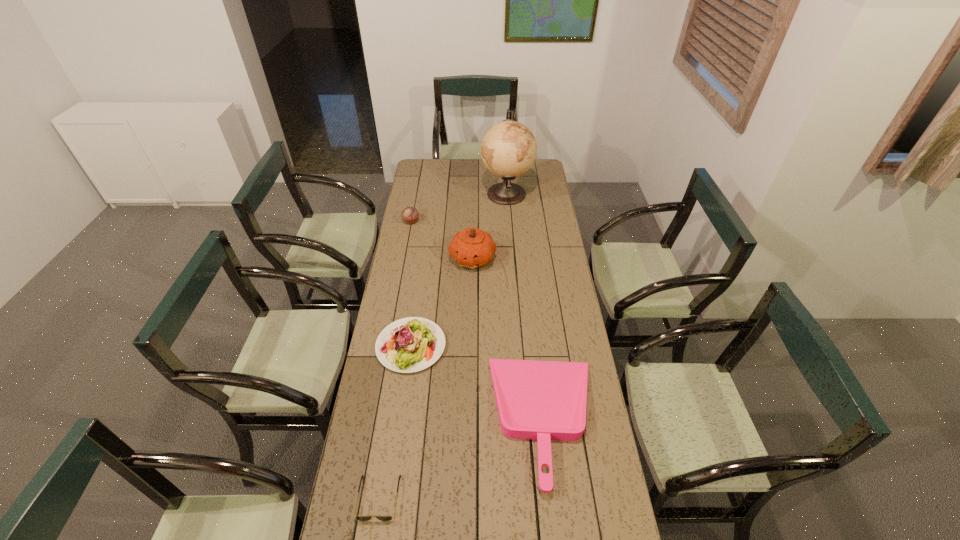
Identify the location of vacant region between the pumpkin and the dustpan. The height and width of the screenshot is (540, 960). (509, 339).

You are a GUI agent. You are given a task and a screenshot of the screen. Output one action in this format:
    pyautogui.click(x=<x>, y=<y>)
    Task: Click on the vacant area that lies between the dustpan and the sunglasses
    This screenshot has width=960, height=540.
    Given the screenshot: What is the action you would take?
    pyautogui.click(x=462, y=458)

Find the location of a particular element. The width and height of the screenshot is (960, 540). unoccupied area between the fifth nearest object and the dustpan is located at coordinates (478, 321).

Identify which object is the third nearest to the sunglasses. Please provide its 2D coordinates. Your answer should be formatted as a tuple, i.e. [(x, y)], where the tuple contains the x and y coordinates of a point satisfying the conditions above.

[(472, 247)]

Identify the location of the fourth closest object relative to the shortest object. (410, 214).

Locate an element on the screen. The width and height of the screenshot is (960, 540). free spot that satisfies the following two spatial constraints: 1. on the handle side of the dustpan; 2. on the front-facing side of the sunglasses is located at coordinates (554, 497).